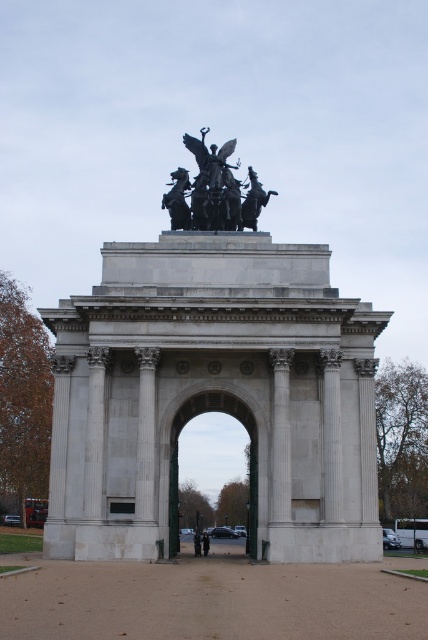
Question: Considering the relative positions of white stone arch at center and polished bronze statue at upper center in the image provided, where is white stone arch at center located with respect to polished bronze statue at upper center?

Choices:
 (A) left
 (B) right

Answer: (B)

Question: Is white stone arch at center below polished bronze statue at upper center?

Choices:
 (A) yes
 (B) no

Answer: (A)

Question: Is white stone arch at center bigger than polished bronze statue at upper center?

Choices:
 (A) no
 (B) yes

Answer: (B)

Question: Which of the following is the closest to the observer?

Choices:
 (A) white stone arch at center
 (B) polished bronze statue at upper center

Answer: (A)

Question: Which point is closer to the camera?

Choices:
 (A) white stone arch at center
 (B) polished bronze statue at upper center

Answer: (A)